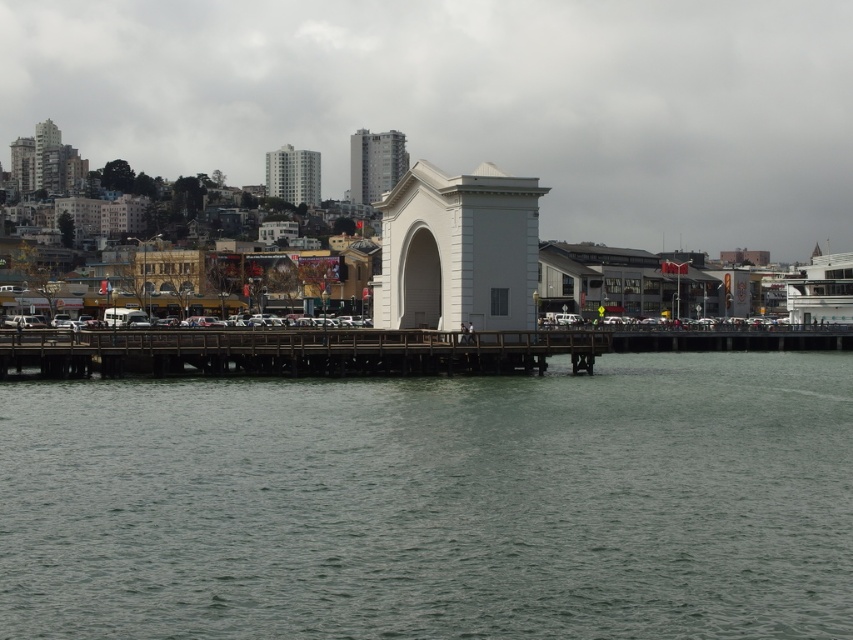
Question: Does green water at lower center lie behind wooden bridge at center?

Choices:
 (A) yes
 (B) no

Answer: (B)

Question: Can you confirm if green water at lower center is wider than wooden bridge at center?

Choices:
 (A) yes
 (B) no

Answer: (A)

Question: Which of the following is the closest to the observer?

Choices:
 (A) green water at lower center
 (B) wooden bridge at center

Answer: (A)

Question: Is green water at lower center further to camera compared to wooden bridge at center?

Choices:
 (A) yes
 (B) no

Answer: (B)